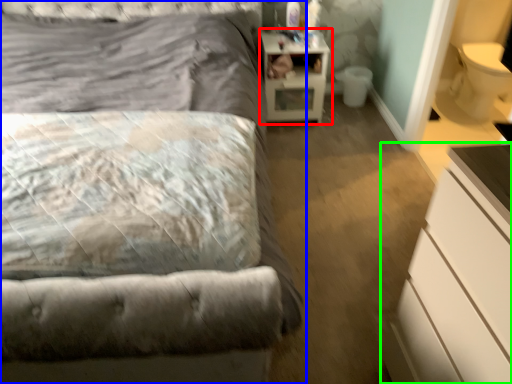
Question: Estimate the real-world distances between objects in this image. Which object is closer to nightstand (highlighted by a red box), bed (highlighted by a blue box) or chest of drawers (highlighted by a green box)?

Choices:
 (A) bed
 (B) chest of drawers

Answer: (A)